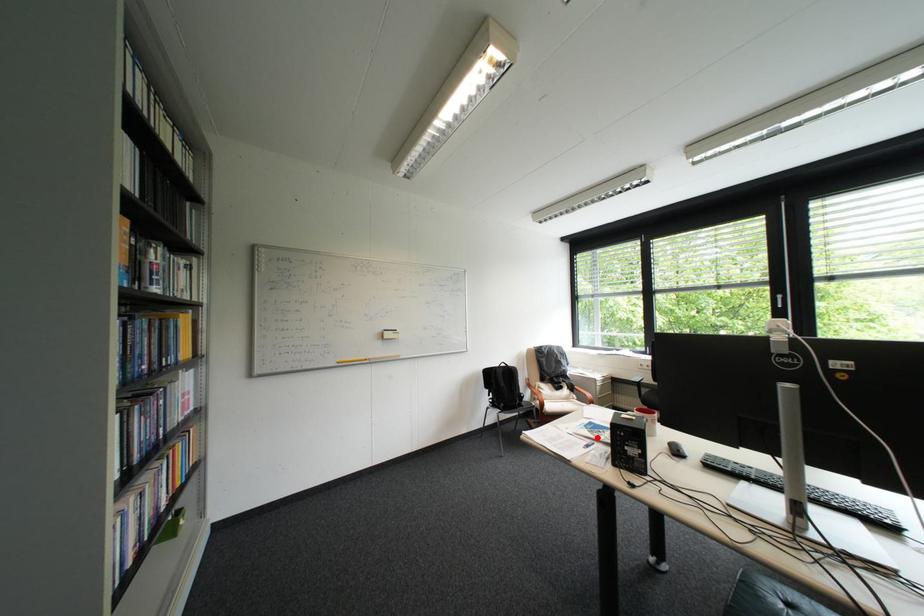
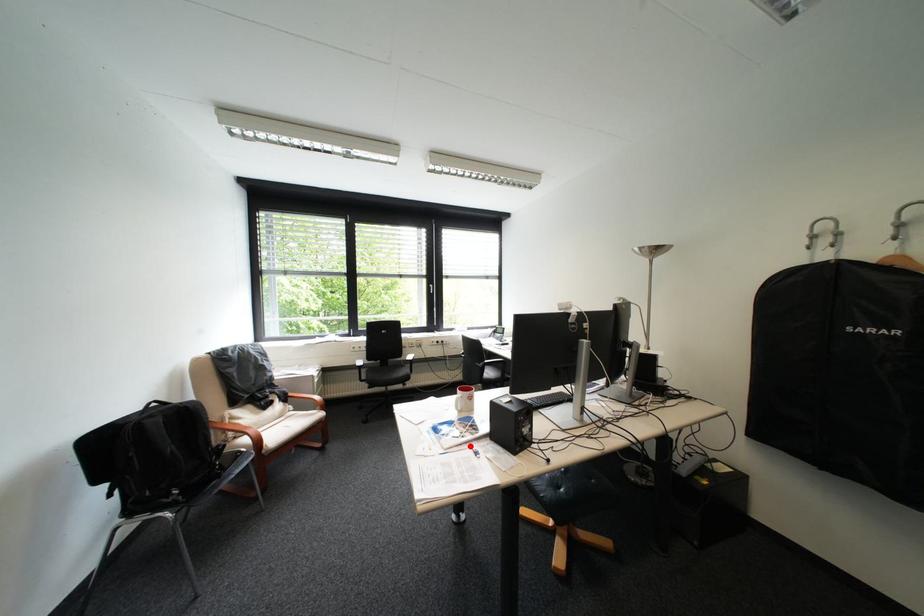
I am providing you with two images of the same scene from different viewpoints. A red point is marked on the first image and another point is marked on the second image. Are the points marked in image1 and image2 representing the same 3D position?

Yes